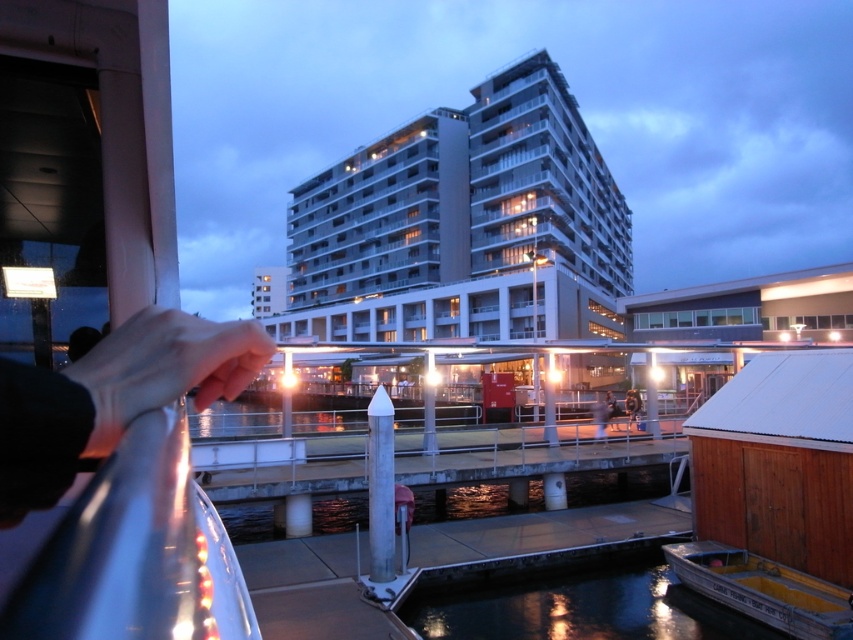
You are an artist trying to sketch this scene. You want to ensure the black leather hand at lower left and dark reflective water at lower center are proportionally accurate. Which object should you draw smaller to maintain the correct proportions?

The black leather hand at lower left should be drawn smaller because it occupies less space than the dark reflective water at lower center according to the description.